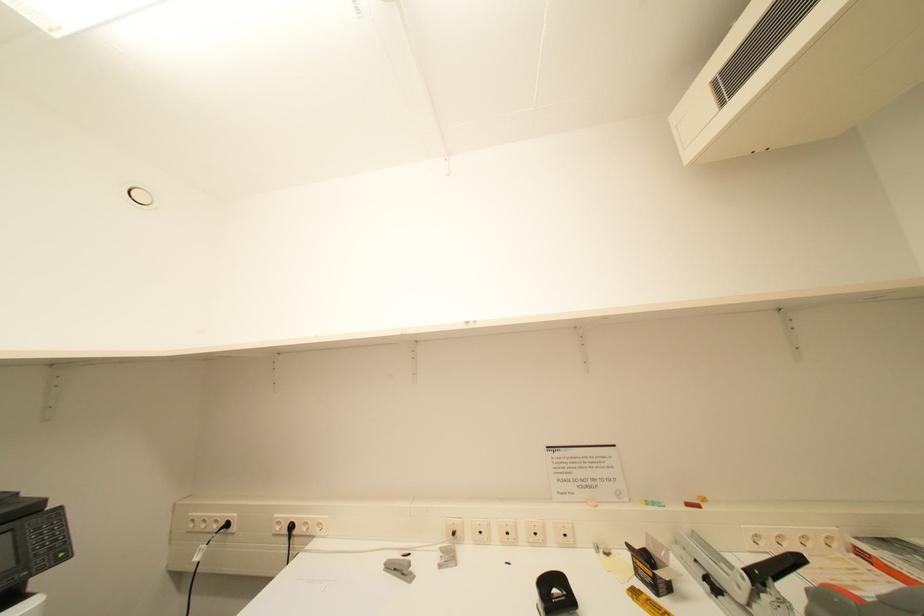
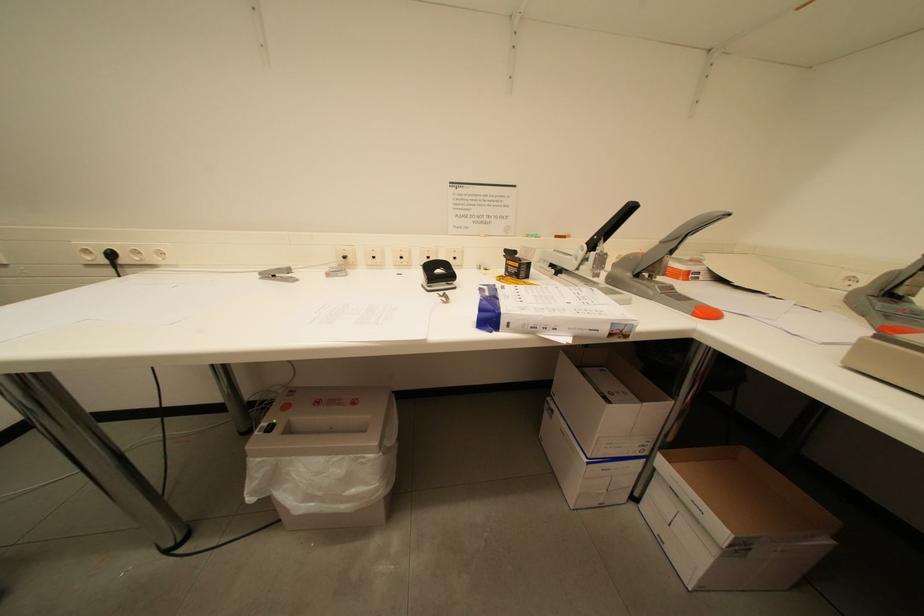
First-person continuous shooting, in which direction is the camera rotating?

The camera rotated toward right-down.